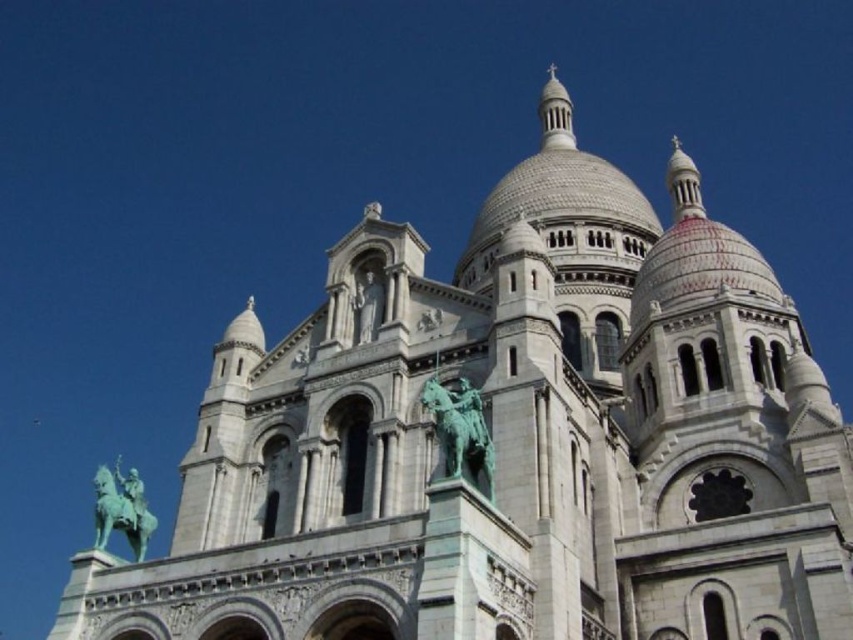
Question: Observing the image, what is the correct spatial positioning of green patina statue at center in reference to white stone statue at center?

Choices:
 (A) right
 (B) left

Answer: (A)

Question: Which object appears closest to the camera in this image?

Choices:
 (A) white stone statue at center
 (B) green patina statue at lower left
 (C) green patina statue at center

Answer: (C)

Question: Is green patina statue at center to the left of green patina statue at lower left from the viewer's perspective?

Choices:
 (A) no
 (B) yes

Answer: (A)

Question: Does green patina statue at lower left appear on the right side of white stone statue at center?

Choices:
 (A) no
 (B) yes

Answer: (A)

Question: Which object is closer to the camera taking this photo?

Choices:
 (A) white stone statue at center
 (B) green patina statue at center
 (C) green patina statue at lower left

Answer: (B)

Question: Which point is farther from the camera taking this photo?

Choices:
 (A) (96, 522)
 (B) (483, 492)

Answer: (A)